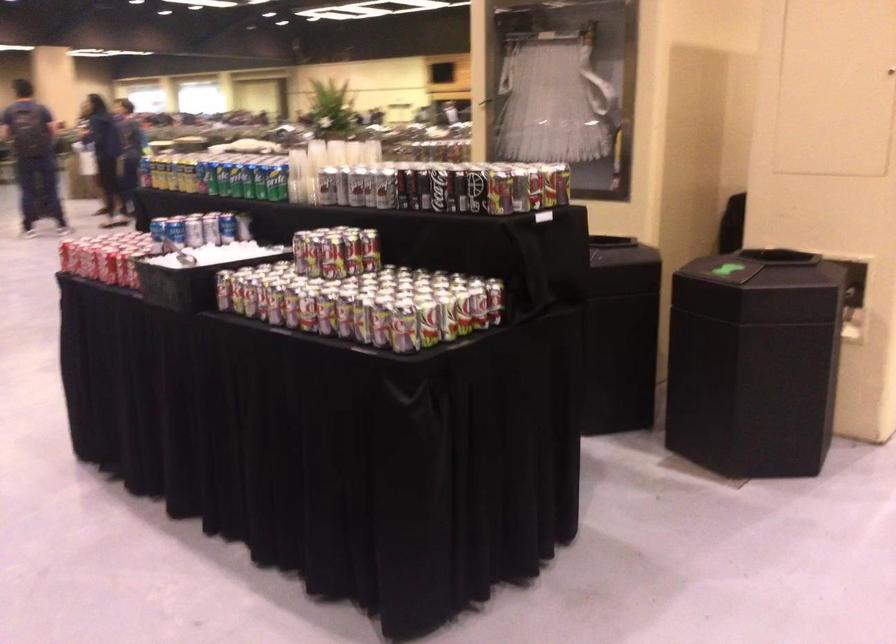
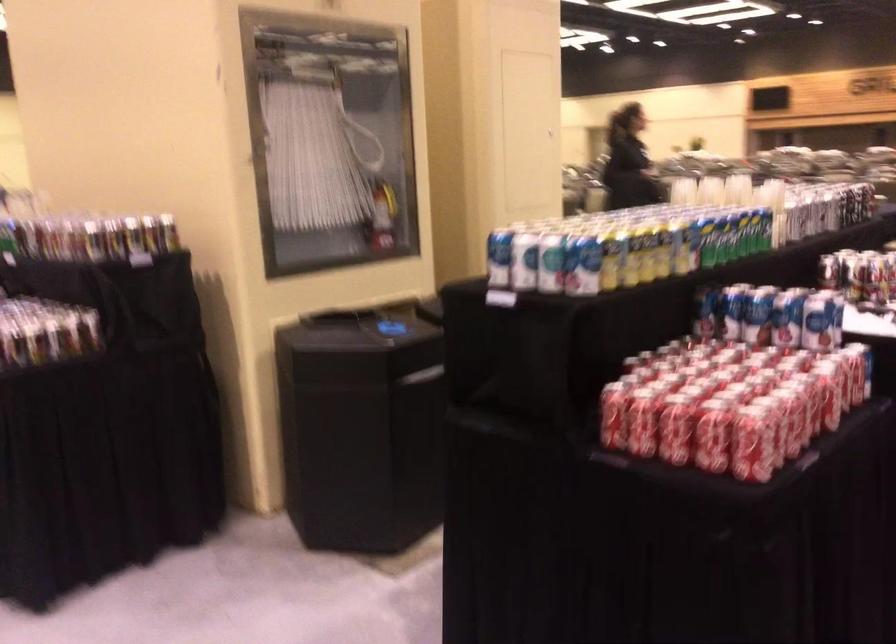
The point at (113, 237) is marked in the first image. Where is the corresponding point in the second image?

(642, 422)